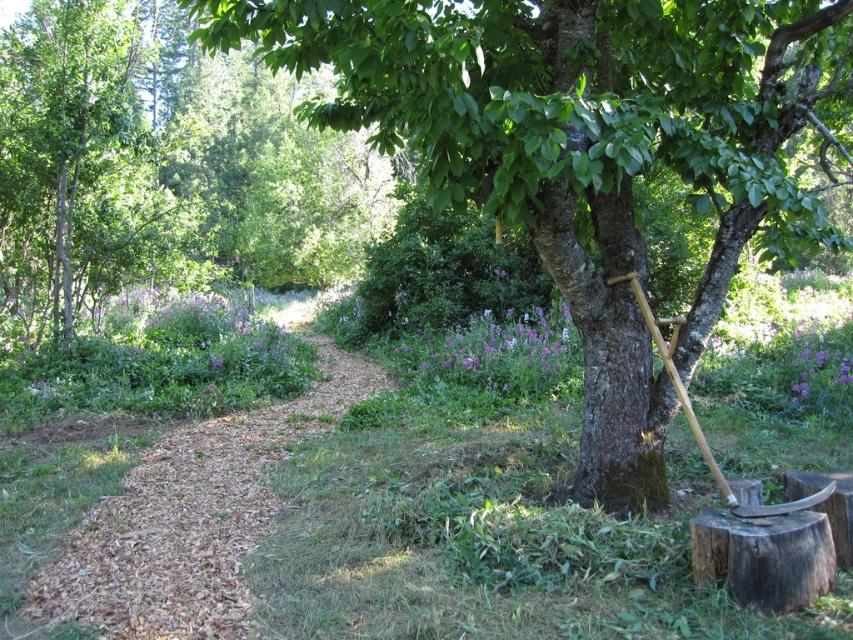
You are standing at the entrance of the garden and see two points marked in the scene. Which point is closer to you, point [756,140] or point [641,310]?

Point [756,140] is closer to you because it is further to the viewer than point [641,310].

You are standing at the point marked by the coordinates (579, 148) in the garden. Looking around, you see a green rough bark tree at center and a wooden tool propped against the tree. Which direction should you walk to reach the wooden tool?

The point marked by the coordinates (579, 148) is at the green rough bark tree at center. Therefore, you are already at the location of the tree, so the wooden tool is right there against the tree. You don